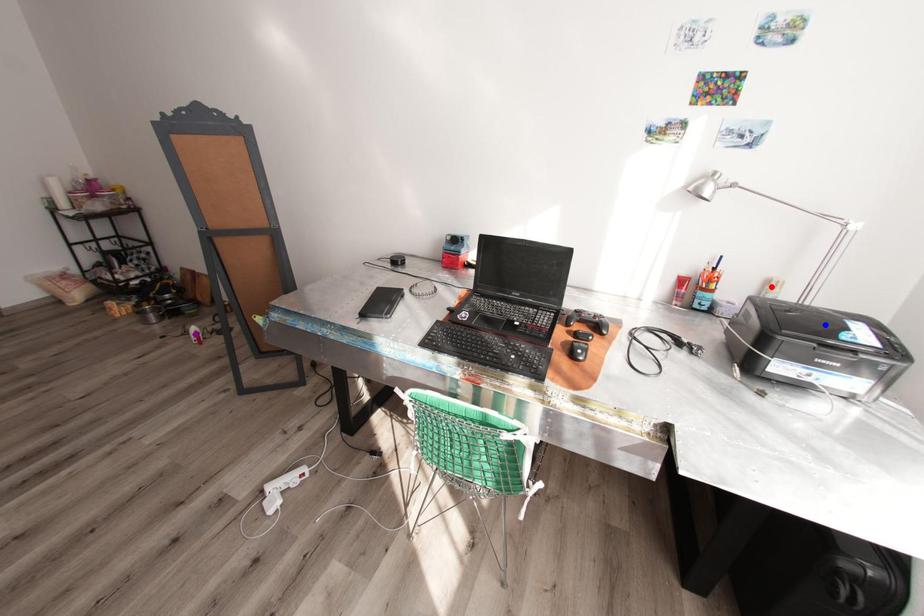
Order these from nearest to farthest:
red point, blue point, purple point

blue point, red point, purple point